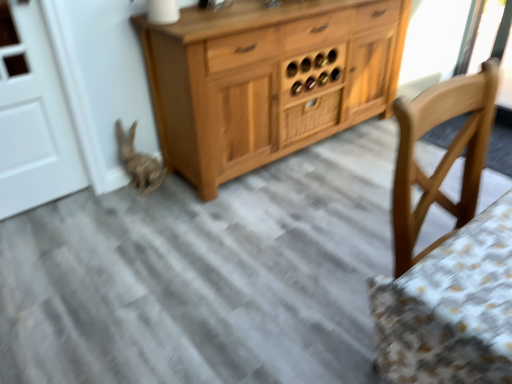
Measure the distance between wooden drawer at center and camera.

wooden drawer at center and camera are 7.95 feet apart from each other.

The image size is (512, 384). What do you see at coordinates (310, 116) in the screenshot? I see `wooden drawer at center` at bounding box center [310, 116].

The width and height of the screenshot is (512, 384). I want to click on wooden drawer at center, so click(x=310, y=116).

What is the approximate width of wooden drawer at center?

The width of wooden drawer at center is 6.60 centimeters.

This screenshot has width=512, height=384. Describe the element at coordinates (138, 162) in the screenshot. I see `bleached wood rabbit at lower left` at that location.

In order to click on bleached wood rabbit at lower left in this screenshot , I will do `click(138, 162)`.

The width and height of the screenshot is (512, 384). Find the location of `wooden drawer at center`. wooden drawer at center is located at coordinates (310, 116).

Considering the positions of objects bleached wood rabbit at lower left and wooden drawer at center in the image provided, who is more to the right, bleached wood rabbit at lower left or wooden drawer at center?

From the viewer's perspective, wooden drawer at center appears more on the right side.

Looking at this image, is bleached wood rabbit at lower left further to camera compared to wooden drawer at center?

No, it is in front of wooden drawer at center.

Does point (115, 129) lie in front of point (288, 115)?

Yes, it is in front of point (288, 115).

From the image's perspective, is bleached wood rabbit at lower left under wooden drawer at center?

Yes, from the image's perspective, bleached wood rabbit at lower left is below wooden drawer at center.

From a real-world perspective, is bleached wood rabbit at lower left below wooden drawer at center?

Yes, from a real-world perspective, bleached wood rabbit at lower left is under wooden drawer at center.

Is bleached wood rabbit at lower left wider or thinner than wooden drawer at center?

In the image, bleached wood rabbit at lower left appears to be wider than wooden drawer at center.

Considering the relative sizes of bleached wood rabbit at lower left and wooden drawer at center in the image provided, is bleached wood rabbit at lower left taller than wooden drawer at center?

Yes, bleached wood rabbit at lower left is taller than wooden drawer at center.

Consider the image. Does bleached wood rabbit at lower left have a larger size compared to wooden drawer at center?

Indeed, bleached wood rabbit at lower left has a larger size compared to wooden drawer at center.

Does bleached wood rabbit at lower left contain wooden drawer at center?

No, wooden drawer at center is not a part of bleached wood rabbit at lower left.

Is bleached wood rabbit at lower left beside wooden drawer at center?

There is a gap between bleached wood rabbit at lower left and wooden drawer at center.

Does bleached wood rabbit at lower left turn towards wooden drawer at center?

No, bleached wood rabbit at lower left is not turned towards wooden drawer at center.

What's the angular difference between bleached wood rabbit at lower left and wooden drawer at center's facing directions?

The angle between the facing direction of bleached wood rabbit at lower left and the facing direction of wooden drawer at center is 0.912 degrees.

Find the location of `drawer that appears behind the bleached wood rabbit at lower left`. drawer that appears behind the bleached wood rabbit at lower left is located at coordinates (310, 116).

Is wooden drawer at center to the left of bleached wood rabbit at lower left from the viewer's perspective?

No, wooden drawer at center is not to the left of bleached wood rabbit at lower left.

Is wooden drawer at center closer to the viewer compared to bleached wood rabbit at lower left?

No, the depth of wooden drawer at center is greater than that of bleached wood rabbit at lower left.

Which is farther, (314,117) or (140,177)?

The point (314,117) is farther.

From the image's perspective, is wooden drawer at center below bleached wood rabbit at lower left?

Incorrect, from the image's perspective, wooden drawer at center is higher than bleached wood rabbit at lower left.

From a real-world perspective, is wooden drawer at center physically below bleached wood rabbit at lower left?

No, from a real-world perspective, wooden drawer at center is not below bleached wood rabbit at lower left.

Is wooden drawer at center wider or thinner than bleached wood rabbit at lower left?

wooden drawer at center is thinner than bleached wood rabbit at lower left.

Based on the photo, is wooden drawer at center shorter than bleached wood rabbit at lower left?

Yes, wooden drawer at center is shorter than bleached wood rabbit at lower left.

Which of these two, wooden drawer at center or bleached wood rabbit at lower left, is smaller?

wooden drawer at center.

Is wooden drawer at center positioned beyond the bounds of bleached wood rabbit at lower left?

Yes, wooden drawer at center is not within bleached wood rabbit at lower left.

Is wooden drawer at center beside bleached wood rabbit at lower left?

wooden drawer at center and bleached wood rabbit at lower left are not in contact.

Could you tell me if wooden drawer at center is turned towards bleached wood rabbit at lower left?

No, wooden drawer at center is not facing towards bleached wood rabbit at lower left.

Measure the distance from wooden drawer at center to bleached wood rabbit at lower left.

35.09 inches.

Locate an element on the screen. This screenshot has width=512, height=384. drawer that is above the bleached wood rabbit at lower left (from a real-world perspective) is located at coordinates (310, 116).

I want to click on drawer to the right of bleached wood rabbit at lower left, so click(x=310, y=116).

Where is `animal below the wooden drawer at center (from a real-world perspective)`? The width and height of the screenshot is (512, 384). animal below the wooden drawer at center (from a real-world perspective) is located at coordinates (138, 162).